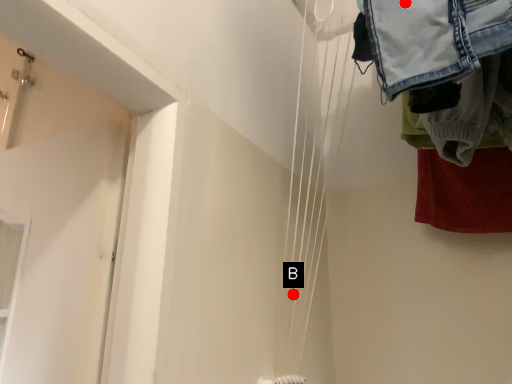
Question: Two points are circled on the image, labeled by A and B beside each circle. Which point appears closest to the camera in this image?

Choices:
 (A) A is closer
 (B) B is closer

Answer: (A)